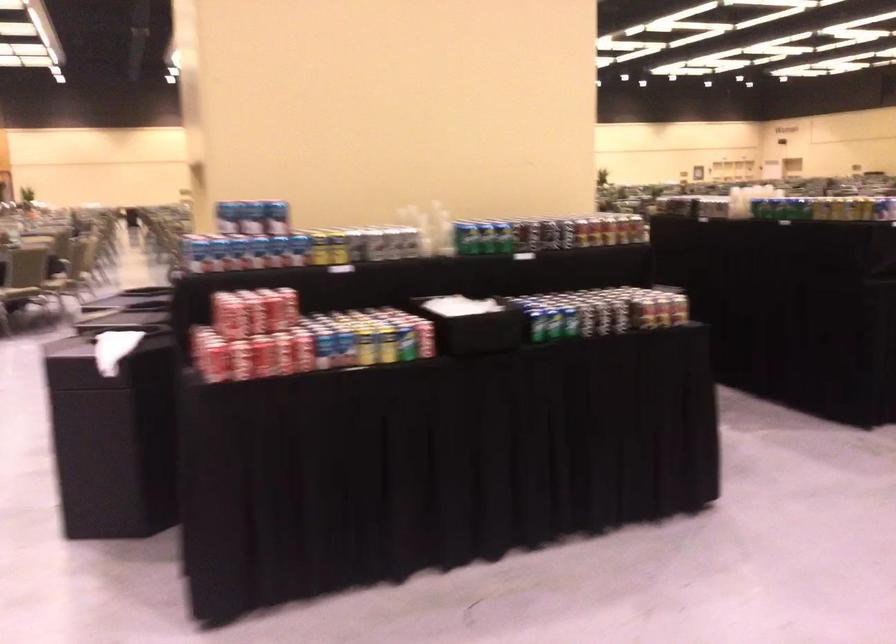
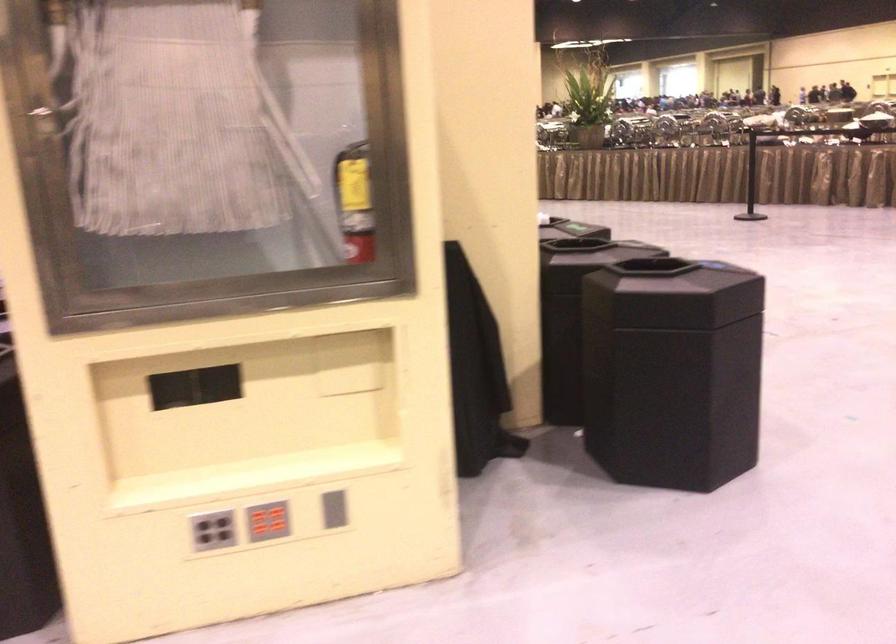
Question: I am providing you with two images of the same scene from different viewpoints. Which of the following objects are not visible in image2?

Choices:
 (A) silver soda can
 (B) black trash can lid
 (C) red button panel
 (D) trash bin flap

Answer: (A)